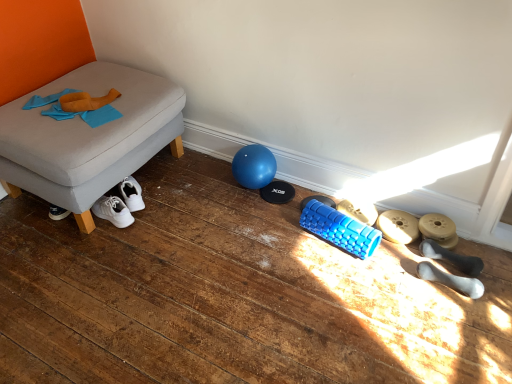
Locate an element on the screen. The image size is (512, 384). free spot below matte gray dumbbell at lower right, the 2th footwear positioned from the back (from a real-world perspective) is located at coordinates (399, 237).